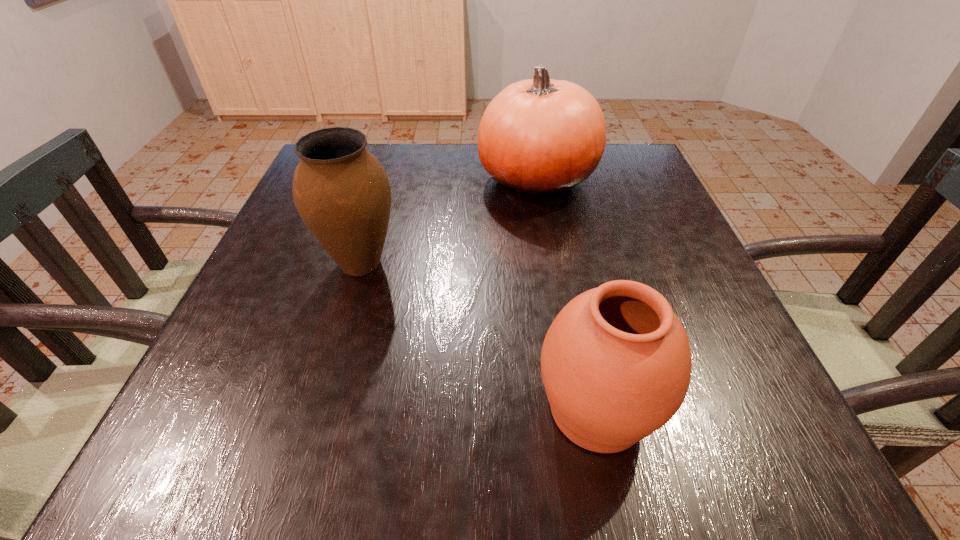
The height and width of the screenshot is (540, 960). Find the location of `free spot that satisfies the following two spatial constraints: 1. on the back side of the second farthest object; 2. on the left side of the farthest object`. free spot that satisfies the following two spatial constraints: 1. on the back side of the second farthest object; 2. on the left side of the farthest object is located at coordinates (385, 179).

I want to click on vacant region that satisfies the following two spatial constraints: 1. on the back side of the pumpkin; 2. on the right side of the leftmost object, so click(x=385, y=179).

Image resolution: width=960 pixels, height=540 pixels. I want to click on free space that satisfies the following two spatial constraints: 1. on the back side of the second farthest object; 2. on the left side of the pumpkin, so click(385, 179).

The width and height of the screenshot is (960, 540). I want to click on free point that satisfies the following two spatial constraints: 1. on the front side of the nearer urn; 2. on the left side of the pumpkin, so click(577, 410).